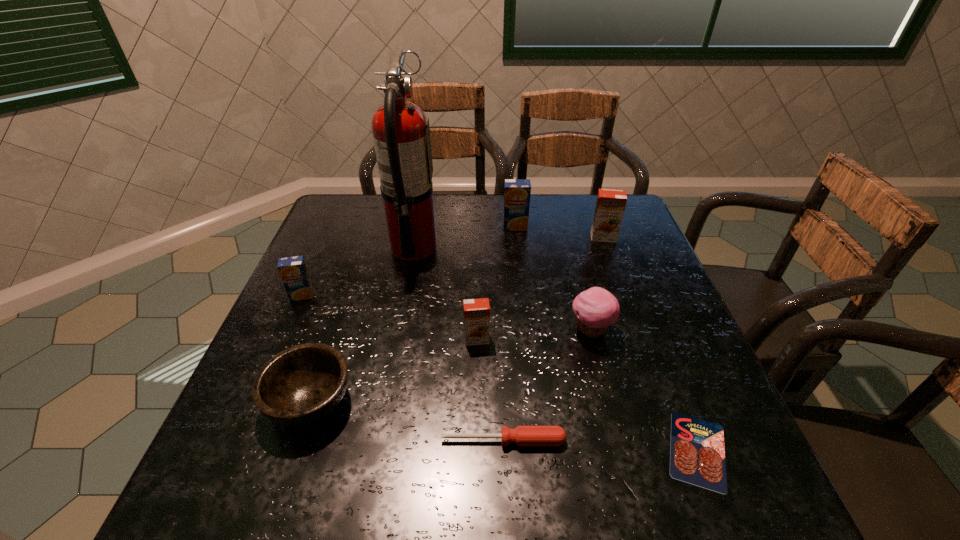
This screenshot has width=960, height=540. In order to click on orange juice that is at the right edge in this screenshot , I will do (610, 206).

In order to click on salami that is at the right edge in this screenshot , I will do `click(697, 456)`.

Find the location of a particular element. object present at the far right corner is located at coordinates (610, 206).

The height and width of the screenshot is (540, 960). I want to click on object that is positioned at the near right corner, so click(x=697, y=456).

The width and height of the screenshot is (960, 540). I want to click on free space at the far edge, so click(554, 226).

The height and width of the screenshot is (540, 960). What are the coordinates of `vacant space at the near edge of the desktop` in the screenshot? It's located at (324, 503).

In the image, there is a desktop. At what (x,y) coordinates should I click in order to perform the action: click on vacant space at the left edge. Please return your answer as a coordinate pair (x, y). Looking at the image, I should click on (324, 313).

This screenshot has width=960, height=540. I want to click on vacant space at the right edge of the desktop, so click(x=608, y=251).

Locate an element on the screen. The image size is (960, 540). vacant space at the near left corner of the desktop is located at coordinates (196, 511).

At what (x,y) coordinates should I click in order to perform the action: click on free location at the far right corner of the desktop. Please return your answer as a coordinate pair (x, y). Looking at the image, I should click on (629, 231).